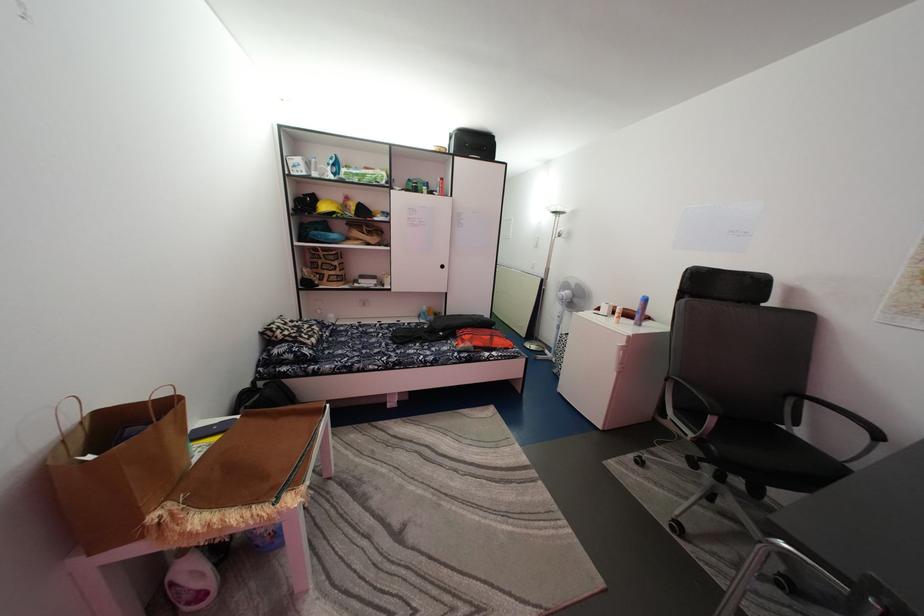
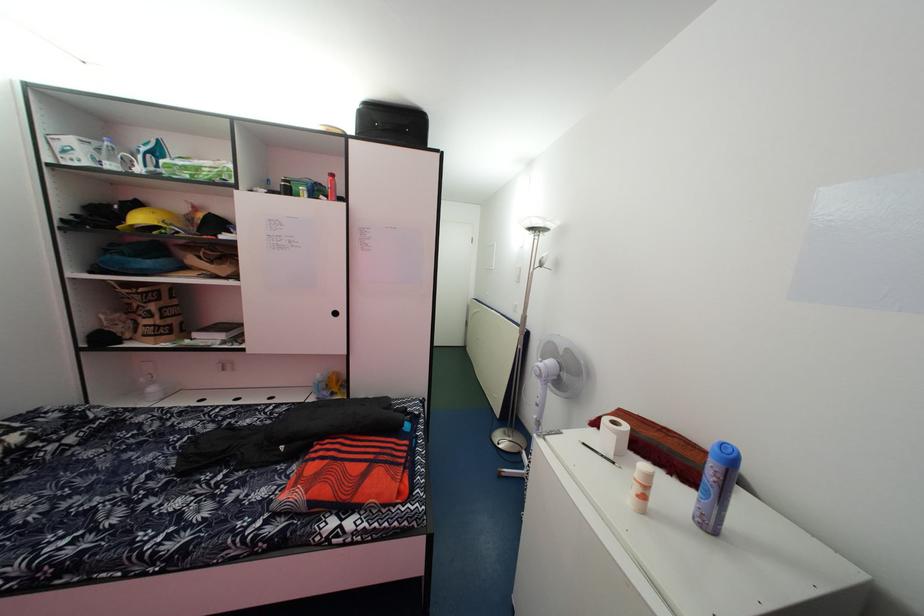
The images are taken continuously from a first-person perspective. In which direction are you moving?

The cameraman walked toward right, forward.